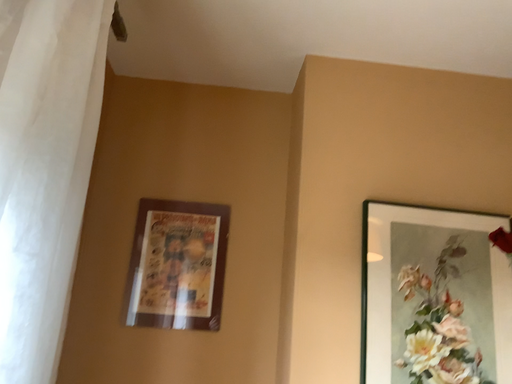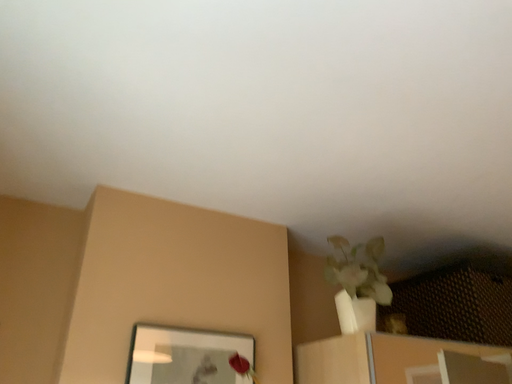
Question: Which way did the camera rotate in the video?

Choices:
 (A) rotated downward
 (B) rotated upward

Answer: (B)